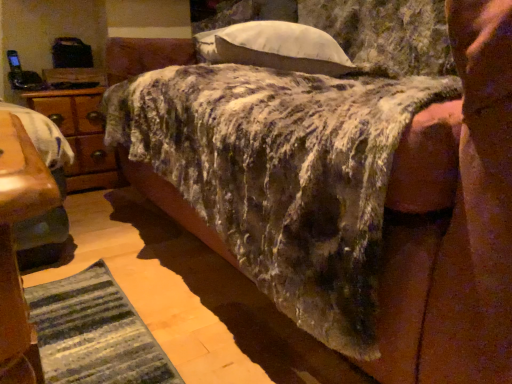
Question: From the image's perspective, is white soft pillow at upper center below fuzzy fabric mattress at center?

Choices:
 (A) yes
 (B) no

Answer: (B)

Question: Is white soft pillow at upper center oriented towards fuzzy fabric mattress at center?

Choices:
 (A) yes
 (B) no

Answer: (A)

Question: Is white soft pillow at upper center wider than fuzzy fabric mattress at center?

Choices:
 (A) no
 (B) yes

Answer: (A)

Question: Is the depth of white soft pillow at upper center less than that of fuzzy fabric mattress at center?

Choices:
 (A) yes
 (B) no

Answer: (B)

Question: Are white soft pillow at upper center and fuzzy fabric mattress at center far apart?

Choices:
 (A) no
 (B) yes

Answer: (A)

Question: Considering the relative sizes of white soft pillow at upper center and fuzzy fabric mattress at center in the image provided, is white soft pillow at upper center bigger than fuzzy fabric mattress at center?

Choices:
 (A) yes
 (B) no

Answer: (B)

Question: From the image's perspective, is white soft pillow at upper center under wooden nightstand at left?

Choices:
 (A) yes
 (B) no

Answer: (B)

Question: Is white soft pillow at upper center taller than wooden nightstand at left?

Choices:
 (A) yes
 (B) no

Answer: (B)

Question: Is white soft pillow at upper center thinner than wooden nightstand at left?

Choices:
 (A) yes
 (B) no

Answer: (B)

Question: Does white soft pillow at upper center turn towards wooden nightstand at left?

Choices:
 (A) no
 (B) yes

Answer: (A)

Question: Considering the relative sizes of white soft pillow at upper center and wooden nightstand at left in the image provided, is white soft pillow at upper center shorter than wooden nightstand at left?

Choices:
 (A) yes
 (B) no

Answer: (A)

Question: Is white soft pillow at upper center to the right of wooden nightstand at left from the viewer's perspective?

Choices:
 (A) no
 (B) yes

Answer: (B)

Question: Considering the relative positions of wooden nightstand at left and white soft pillow at upper center in the image provided, is wooden nightstand at left to the right of white soft pillow at upper center from the viewer's perspective?

Choices:
 (A) yes
 (B) no

Answer: (B)